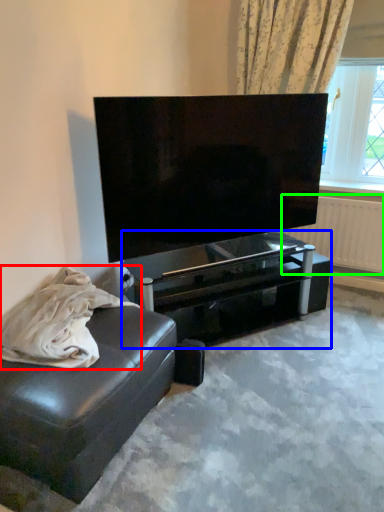
Question: Considering the real-world distances, which object is farthest from material (highlighted by a red box)? table (highlighted by a blue box) or radiator (highlighted by a green box)?

Choices:
 (A) table
 (B) radiator

Answer: (B)